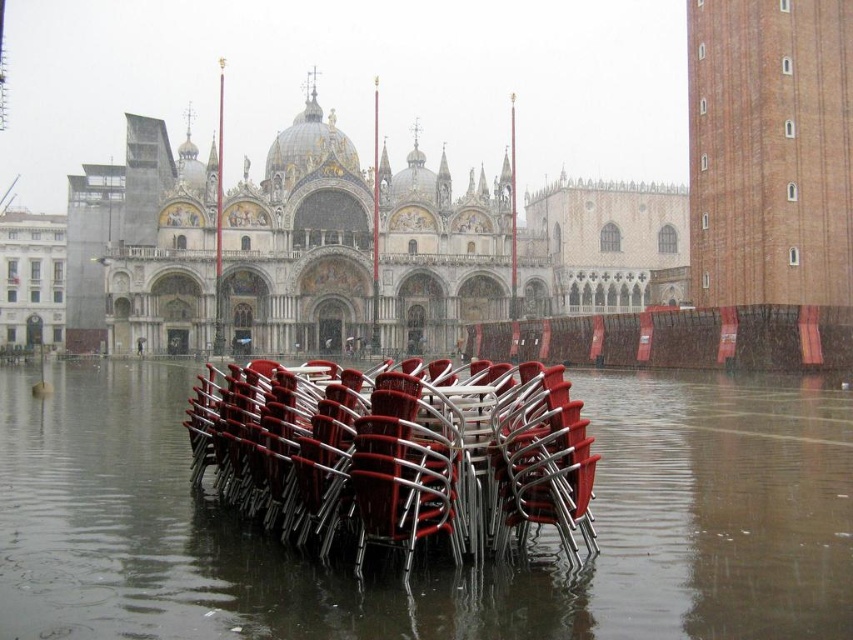
You are a tourist visiting Venice and you see the red plastic chairs at center and the metallic red chairs at lower center in St. Mark Square. Which set of chairs is closer to the Basilica di San Marco?

The metallic red chairs at lower center are closer to the Basilica di San Marco because the red plastic chairs at center are positioned below them, indicating a lower spatial position.

You are a tourist visiting St. Mark Square in Venice and see the red plastic chairs at center and the metallic red chairs at lower center. Which group of chairs is positioned closer to the Basilica di San Marco?

The metallic red chairs at lower center are closer to the Basilica di San Marco because they are located at lower center, which is closer to the basilica in the background compared to the red plastic chairs at center to their right.

From the picture: You are a tourist in Venice and you want to take a photo of the Basilica di San Marco without any obstructions. There are red plastic chairs at center in the way. Where should you move to get a clear view?

Result: To avoid the red plastic chairs at center, move to a position where you are not at point (433, 570). For example, moving to the left or right of the chairs would provide an unobstructed view of the Basilica di San Marco.